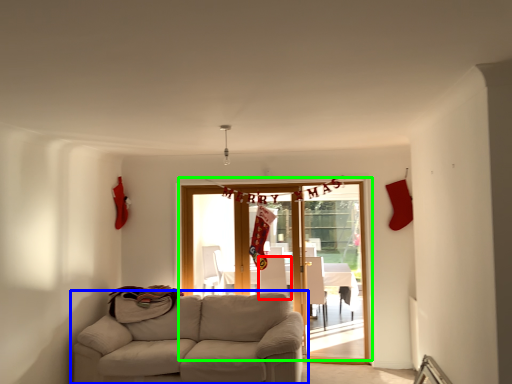
Question: Which object is the farthest from armchair (highlighted by a red box)? Choose among these: studio couch (highlighted by a blue box) or door (highlighted by a green box).

Choices:
 (A) studio couch
 (B) door

Answer: (A)